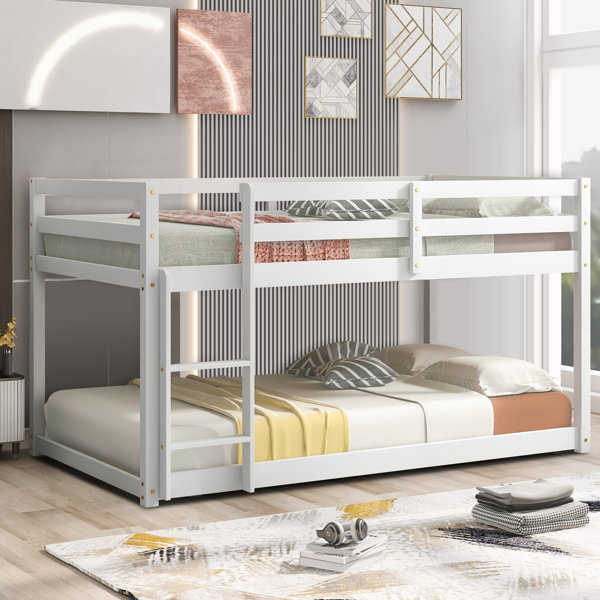
The width and height of the screenshot is (600, 600). What are the coordinates of `sheets` in the screenshot? It's located at (135, 411), (190, 252).